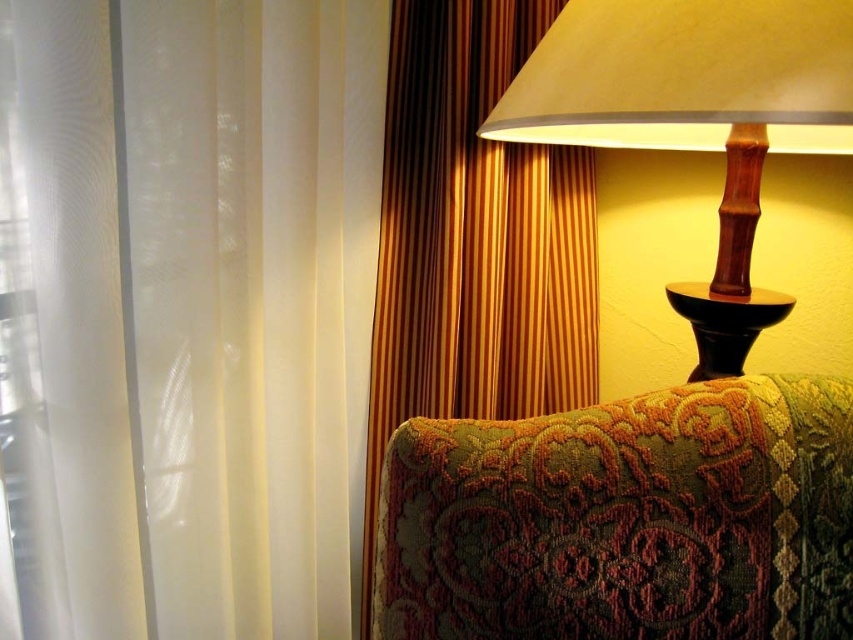
Question: Can you confirm if wooden table lamp at upper right is positioned to the right of black wood side table at right?

Choices:
 (A) no
 (B) yes

Answer: (A)

Question: Does white sheer curtain at left appear on the left side of gold striped curtain at upper right?

Choices:
 (A) yes
 (B) no

Answer: (A)

Question: Among these objects, which one is nearest to the camera?

Choices:
 (A) gold striped curtain at upper right
 (B) white sheer curtain at left

Answer: (B)

Question: Which of the following is the farthest from the observer?

Choices:
 (A) black wood side table at right
 (B) white sheer curtain at left

Answer: (A)

Question: Where is gold striped curtain at upper right located in relation to black wood side table at right in the image?

Choices:
 (A) below
 (B) above

Answer: (A)

Question: Which object is closer to the camera taking this photo?

Choices:
 (A) wooden table lamp at upper right
 (B) white sheer curtain at left
 (C) black wood side table at right

Answer: (A)